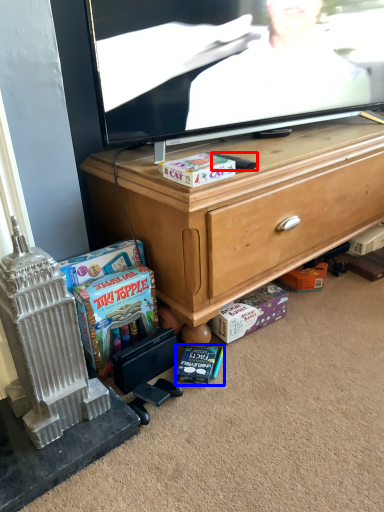
Question: Which object is further to the camera taking this photo, remote control (highlighted by a red box) or book (highlighted by a blue box)?

Choices:
 (A) remote control
 (B) book

Answer: (A)